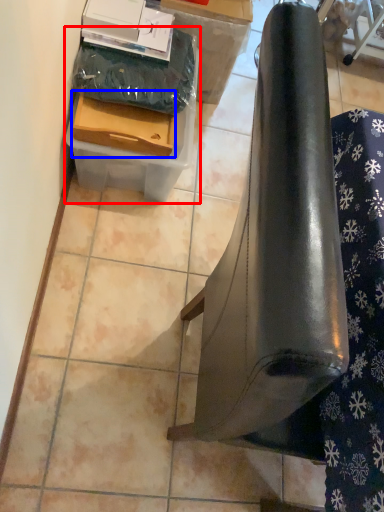
Question: Which object is closer to the camera taking this photo, cardboard box (highlighted by a red box) or drawer (highlighted by a blue box)?

Choices:
 (A) cardboard box
 (B) drawer

Answer: (B)